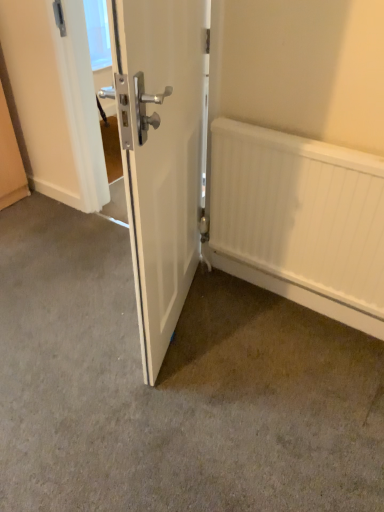
Question: Can you confirm if white matte radiator at lower right is positioned to the right of smooth concrete floor at center?

Choices:
 (A) no
 (B) yes

Answer: (B)

Question: Considering the relative sizes of white matte radiator at lower right and smooth concrete floor at center in the image provided, is white matte radiator at lower right taller than smooth concrete floor at center?

Choices:
 (A) no
 (B) yes

Answer: (B)

Question: Would you say smooth concrete floor at center is part of white matte radiator at lower right's contents?

Choices:
 (A) no
 (B) yes

Answer: (A)

Question: Is white matte radiator at lower right at the left side of smooth concrete floor at center?

Choices:
 (A) no
 (B) yes

Answer: (A)

Question: Is white matte radiator at lower right in front of smooth concrete floor at center?

Choices:
 (A) yes
 (B) no

Answer: (B)

Question: From the image's perspective, is white matte radiator at lower right on smooth concrete floor at center?

Choices:
 (A) yes
 (B) no

Answer: (A)

Question: Considering the relative positions of smooth concrete floor at center and white glossy door at center in the image provided, is smooth concrete floor at center to the left of white glossy door at center from the viewer's perspective?

Choices:
 (A) no
 (B) yes

Answer: (B)

Question: Is smooth concrete floor at center surrounding white glossy door at center?

Choices:
 (A) no
 (B) yes

Answer: (A)

Question: Is the position of smooth concrete floor at center more distant than that of white glossy door at center?

Choices:
 (A) yes
 (B) no

Answer: (A)

Question: Does smooth concrete floor at center have a larger size compared to white glossy door at center?

Choices:
 (A) no
 (B) yes

Answer: (B)

Question: Can you confirm if smooth concrete floor at center is positioned to the right of white glossy door at center?

Choices:
 (A) no
 (B) yes

Answer: (A)

Question: Is smooth concrete floor at center facing away from white glossy door at center?

Choices:
 (A) yes
 (B) no

Answer: (B)

Question: Can you confirm if white matte radiator at lower right is bigger than white glossy door at center?

Choices:
 (A) no
 (B) yes

Answer: (A)